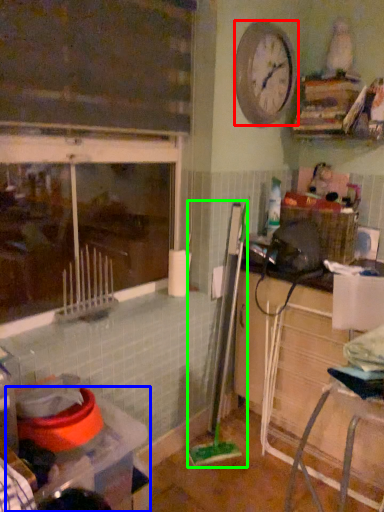
Question: Which is farther away from clock (highlighted by a red box)? table (highlighted by a blue box) or brush (highlighted by a green box)?

Choices:
 (A) table
 (B) brush

Answer: (B)